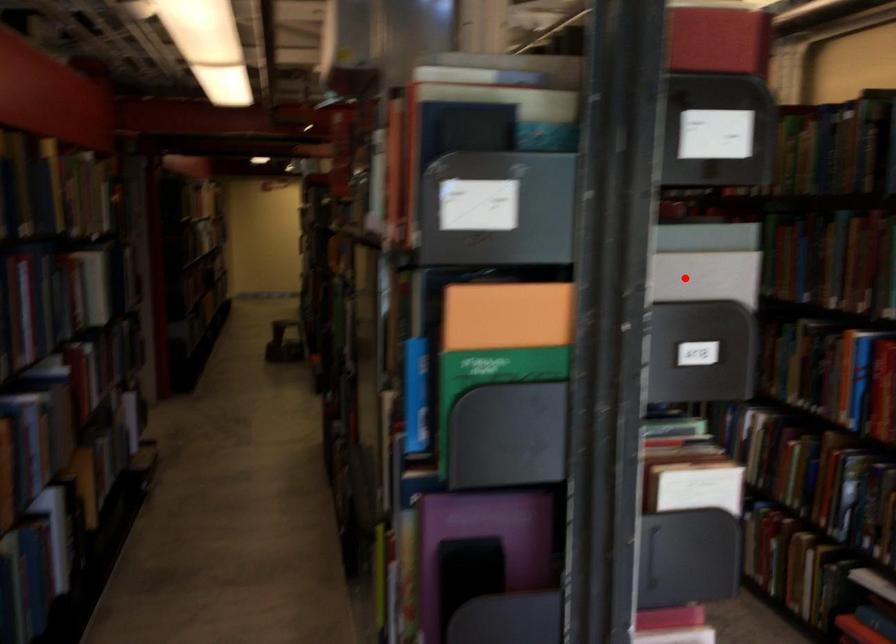
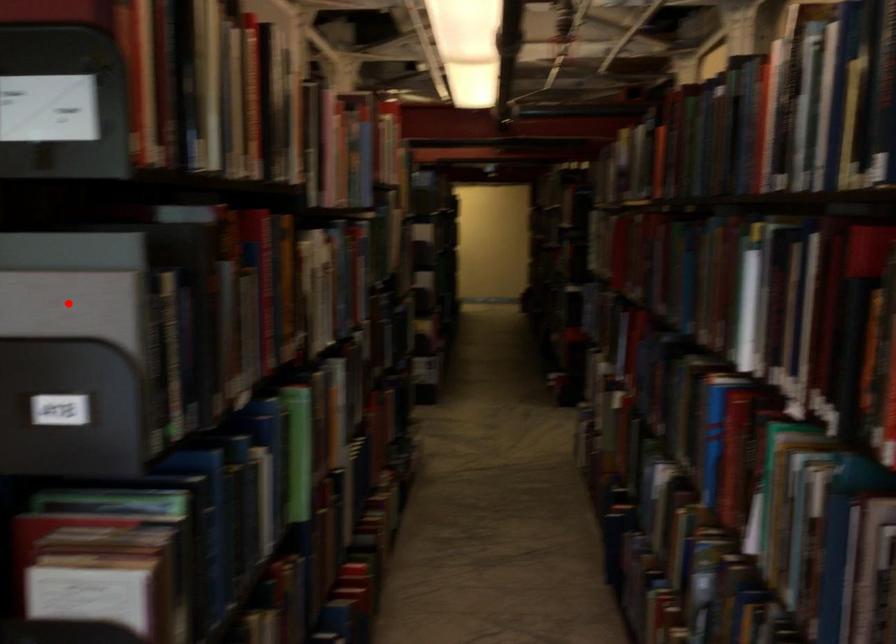
I am providing you with two images of the same scene from different viewpoints. A red point is marked on the first image and another point is marked on the second image. Does the point marked in image1 correspond to the same location as the one in image2?

Yes